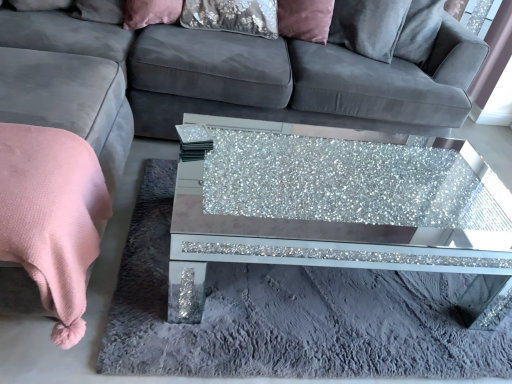
Question: From their relative heights in the image, would you say pink soft blanket at lower left is taller or shorter than velvet pink pillow at upper center?

Choices:
 (A) tall
 (B) short

Answer: (A)

Question: Would you say pink soft blanket at lower left is to the left or to the right of velvet pink pillow at upper center in the picture?

Choices:
 (A) right
 (B) left

Answer: (B)

Question: Estimate the real-world distances between objects in this image. Which object is farther from the velvet fabric couch at center?

Choices:
 (A) pink soft blanket at lower left
 (B) glittery mirrored coffee table at center
 (C) velvet pink pillow at upper center

Answer: (B)

Question: Which object is positioned closest to the velvet pink pillow at upper center?

Choices:
 (A) pink soft blanket at lower left
 (B) glittery mirrored coffee table at center
 (C) velvet fabric couch at center

Answer: (C)